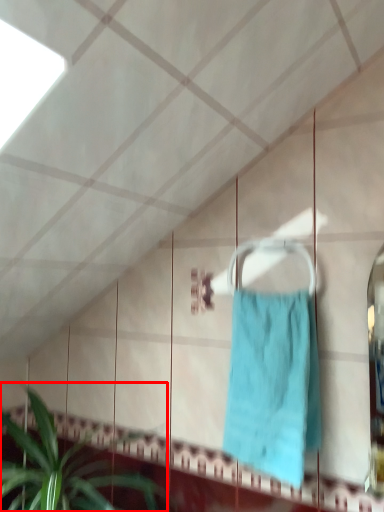
Question: Where is houseplant (annotated by the red box) located in relation to towel in the image?

Choices:
 (A) right
 (B) left

Answer: (B)